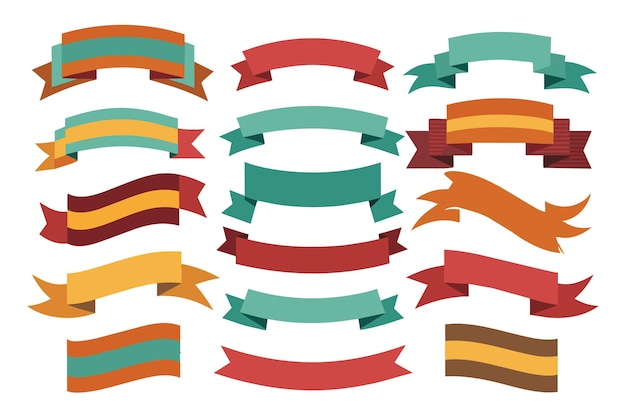
Identify the location of left column. Image resolution: width=626 pixels, height=417 pixels. (120, 351), (123, 273), (120, 203), (114, 119), (123, 42).